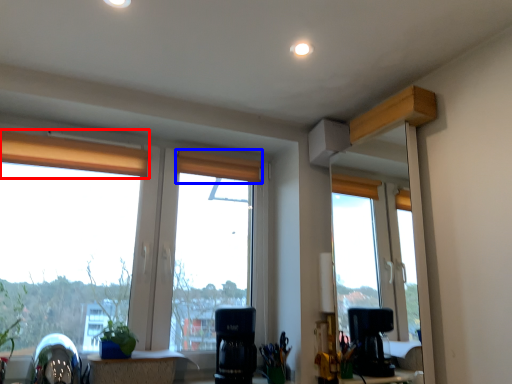
Question: Among these objects, which one is farthest to the camera, curtain (highlighted by a red box) or curtain (highlighted by a blue box)?

Choices:
 (A) curtain
 (B) curtain

Answer: (B)